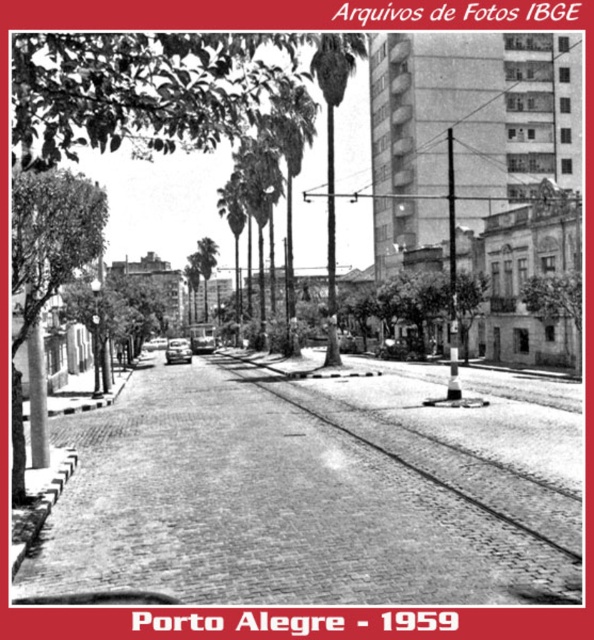
You are standing at the point labeled point (x=273, y=388) and want to walk towards the point labeled point (x=182, y=349). Since both points are in the image, which direction should you move relative to the camera?

You should move away from the camera because point (x=182, y=349) is farther from the camera than point (x=273, y=388).

You are a pedestrian standing on the sidewalk in the scene. You want to cross the street to reach the palm trees on the other side. The cobblestone train track at center and the shiny silver car at center are in your path. Which object do you need to step over first?

The cobblestone train track at center is closer to the viewer than the shiny silver car at center, so you need to step over the cobblestone train track at center first.

You are a pedestrian standing on the sidewalk in this historical street scene. You want to cross the street to reach the palm trees on the other side. Is the shiny silver car at center blocking your path to the cobblestone train track at center?

The cobblestone train track at center is positioned under the shiny silver car at center, so the car is blocking the path to the cobblestone train track at center. You should wait for the car to move before proceeding.